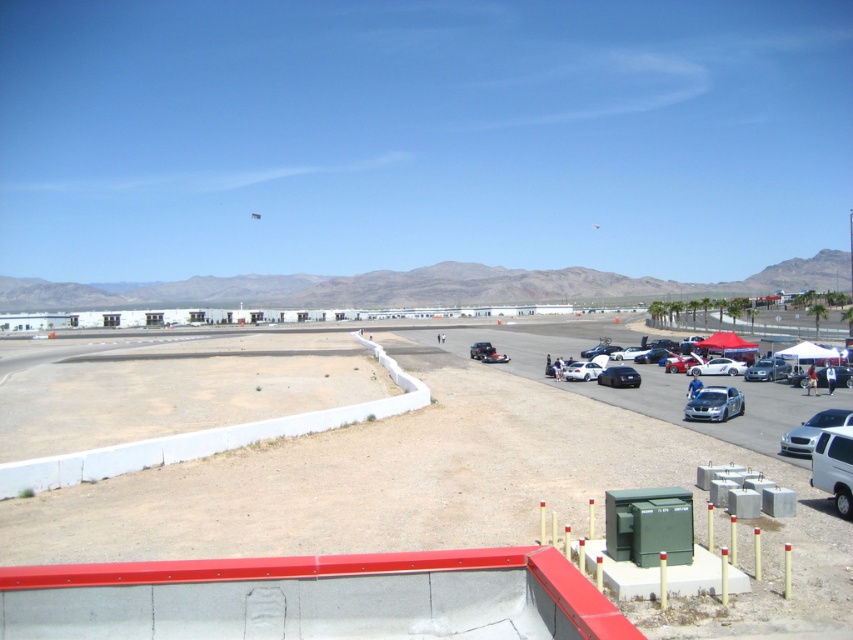
Question: Among these objects, which one is nearest to the camera?

Choices:
 (A) shiny silver car at center right
 (B) white matte car at center

Answer: (B)

Question: Which point is farther from the camera taking this photo?

Choices:
 (A) (785, 365)
 (B) (715, 371)
 (C) (572, 364)

Answer: (C)

Question: Can you confirm if shiny black car at lower right is positioned below shiny silver car at center right?

Choices:
 (A) yes
 (B) no

Answer: (A)

Question: Which object is closer to the camera taking this photo?

Choices:
 (A) satin silver car at lower right
 (B) shiny silver sedan at lower right
 (C) shiny silver car at center right
 (D) white glossy sedan at lower right

Answer: (D)

Question: Is shiny black car at lower right above shiny silver car at center right?

Choices:
 (A) no
 (B) yes

Answer: (A)

Question: Can you confirm if white glossy sedan at lower right is thinner than shiny silver car at center right?

Choices:
 (A) yes
 (B) no

Answer: (B)